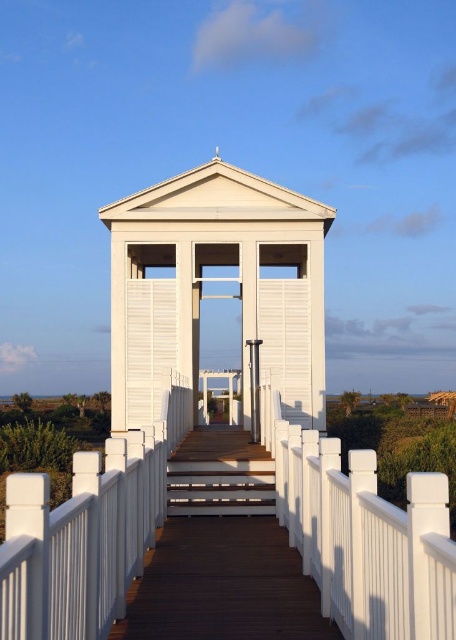
You are standing at the starting point of the walkway leading to the gazebo. You notice two points marked on the walkway. One is labeled as point (248, 275) and the other as point (234, 444). Which point is closer to the gazebo?

Point (248, 275) is behind point (234, 444), so the gazebo is closer to point (248, 275) than point (234, 444).

You are a painter standing at the beginning of the walkway and want to paint both the white matte gazebo at center and the brown wooden stairs at center. Which object should you focus on first if you want to paint the larger one first?

The white matte gazebo at center is larger in size than the brown wooden stairs at center, so you should focus on painting the white matte gazebo at center first.